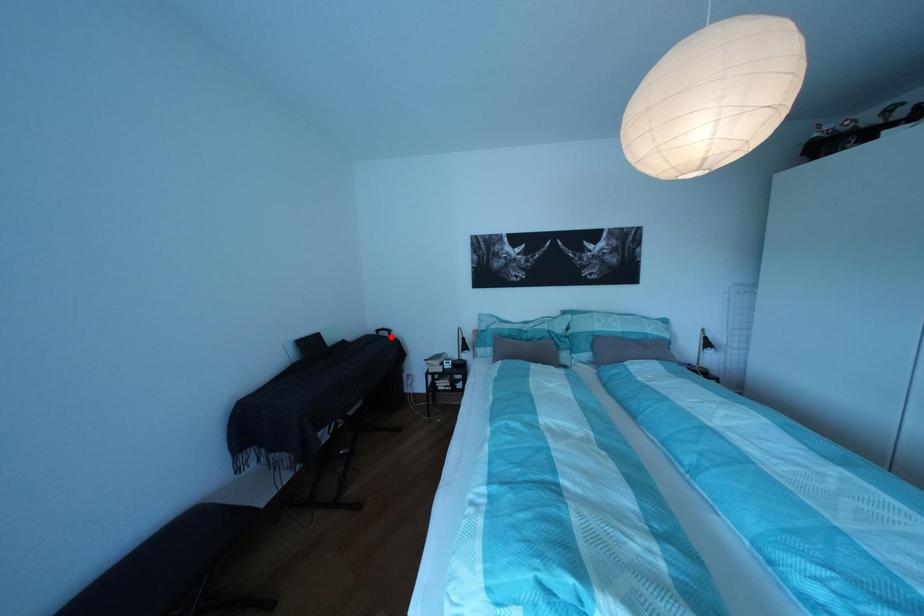
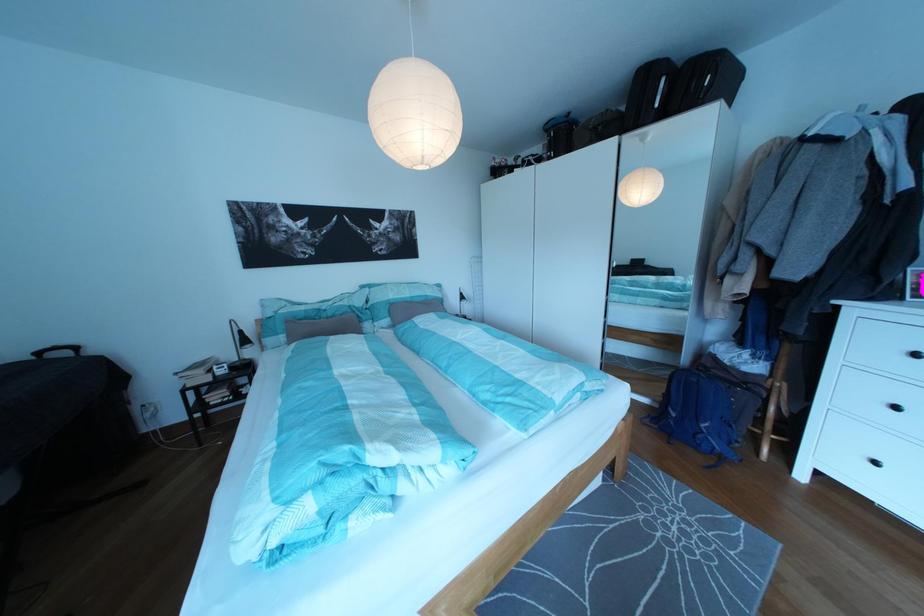
Question: A red point is marked in image1. In image2, is the corresponding 3D point closer to the camera or farther? Reply with the corresponding letter.

Choices:
 (A) The corresponding 3D point is closer.
 (B) The corresponding 3D point is farther.

Answer: (B)